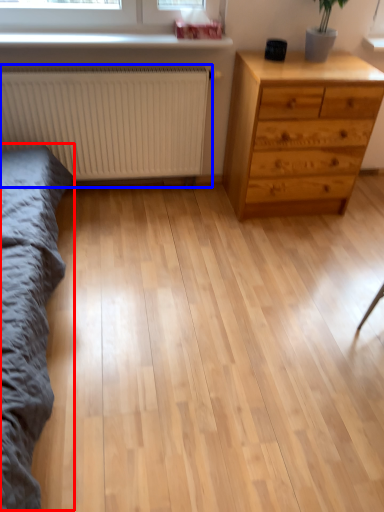
Question: Which of the following is the farthest to the observer, bed frame (highlighted by a red box) or radiator (highlighted by a blue box)?

Choices:
 (A) bed frame
 (B) radiator

Answer: (B)